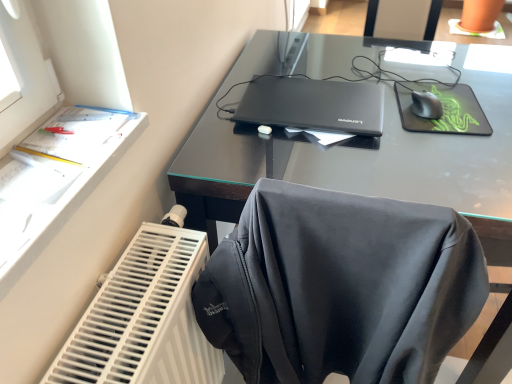
Question: From a real-world perspective, is black matte mouse at upper right physically below white plastic radiator at lower left?

Choices:
 (A) yes
 (B) no

Answer: (B)

Question: Can you confirm if black matte mouse at upper right is smaller than white plastic radiator at lower left?

Choices:
 (A) yes
 (B) no

Answer: (A)

Question: Does black matte mouse at upper right have a lesser width compared to white plastic radiator at lower left?

Choices:
 (A) no
 (B) yes

Answer: (B)

Question: Is black matte mouse at upper right facing towards white plastic radiator at lower left?

Choices:
 (A) yes
 (B) no

Answer: (B)

Question: From the image's perspective, is black matte mouse at upper right located above white plastic radiator at lower left?

Choices:
 (A) no
 (B) yes

Answer: (B)

Question: From their relative heights in the image, would you say black matte laptop at center is taller or shorter than black glass desk at center?

Choices:
 (A) tall
 (B) short

Answer: (B)

Question: From a real-world perspective, is black matte laptop at center above or below black glass desk at center?

Choices:
 (A) below
 (B) above

Answer: (B)

Question: In the image, is black matte laptop at center on the left side or the right side of black glass desk at center?

Choices:
 (A) right
 (B) left

Answer: (B)

Question: From the image's perspective, is black matte laptop at center positioned above or below black glass desk at center?

Choices:
 (A) above
 (B) below

Answer: (A)

Question: Considering the positions of white plastic radiator at lower left and black matte mouse at upper right in the image, is white plastic radiator at lower left wider or thinner than black matte mouse at upper right?

Choices:
 (A) wide
 (B) thin

Answer: (A)

Question: From a real-world perspective, is white plastic radiator at lower left above or below black matte mouse at upper right?

Choices:
 (A) below
 (B) above

Answer: (A)

Question: Visually, is white plastic radiator at lower left positioned to the left or to the right of black matte mouse at upper right?

Choices:
 (A) right
 (B) left

Answer: (B)

Question: Considering the positions of white plastic radiator at lower left and black matte mouse at upper right in the image, is white plastic radiator at lower left taller or shorter than black matte mouse at upper right?

Choices:
 (A) short
 (B) tall

Answer: (B)

Question: Considering the relative positions of green matte mousepad at upper right and black matte laptop at center in the image provided, is green matte mousepad at upper right to the left or to the right of black matte laptop at center?

Choices:
 (A) left
 (B) right

Answer: (B)

Question: Is green matte mousepad at upper right situated inside black matte laptop at center or outside?

Choices:
 (A) outside
 (B) inside

Answer: (A)